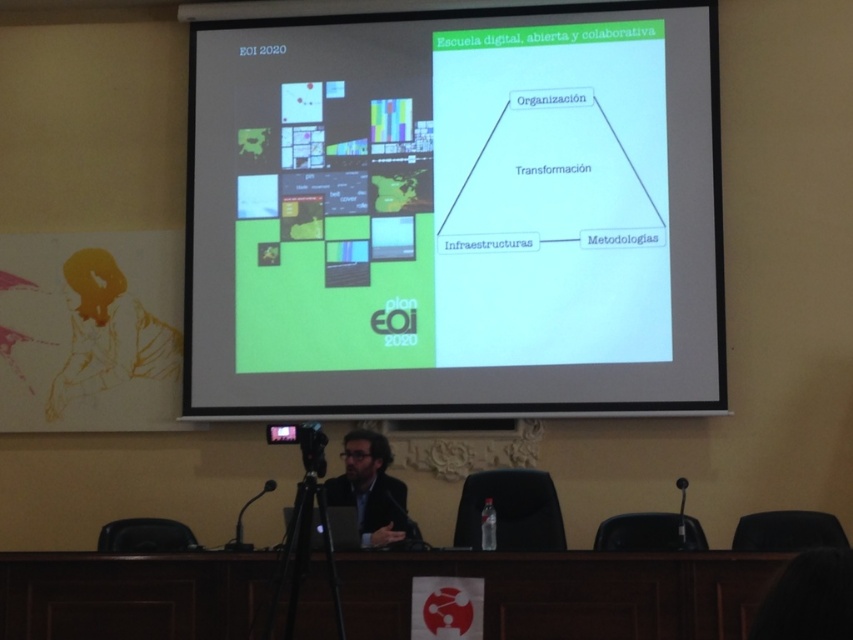
You are standing in the conference room and need to place a 5 meter long banner on the brown wooden table at lower center. Can the banner fit on the table?

The brown wooden table at lower center is 4.03 meters away from viewer. The distance from the viewer to the table does not indicate the table length. Without knowing the table length, it is impossible to determine if the banner can fit.

You are standing in the conference room and want to take a photo of the white matte projector screen at upper center. Your camera has a maximum focus range of 5 meters. Will you be able to focus on the screen from your current position?

The distance between you and the white matte projector screen at upper center is 5.59 meters, which exceeds the camera maximum focus range of 5 meters. You need to move closer to the screen to take a clear photo.

You are an event organizer who needs to set up a new microphone stand. The stand can only hold a microphone that is narrower than the white matte projector screen at upper center. Based on the image provided, can the black plastic microphone at lower left be placed on the stand?

The white matte projector screen at upper center might be wider than black plastic microphone at lower left, so it is possible that the black plastic microphone at lower left can be placed on the stand since it is narrower than the screen.